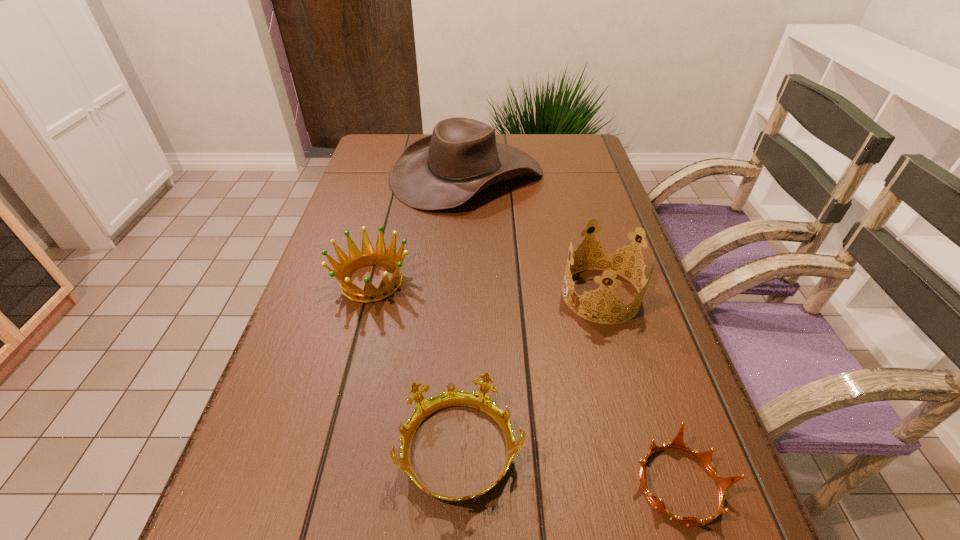
Where is `free space located 0.070m on the back of the shortest crown`? The width and height of the screenshot is (960, 540). free space located 0.070m on the back of the shortest crown is located at coordinates (x=653, y=401).

I want to click on object located in the far edge section of the desktop, so click(461, 157).

At what (x,y) coordinates should I click in order to perform the action: click on cowboy hat that is at the left edge. Please return your answer as a coordinate pair (x, y). Looking at the image, I should click on (461, 157).

At what (x,y) coordinates should I click in order to perform the action: click on crown that is at the left edge. Please return your answer as a coordinate pair (x, y). This screenshot has height=540, width=960. Looking at the image, I should click on (356, 260).

Where is `object that is at the far left corner`? This screenshot has width=960, height=540. object that is at the far left corner is located at coordinates (461, 157).

Identify the location of vacant space at the far edge of the desktop. The width and height of the screenshot is (960, 540). (504, 143).

In the image, there is a desktop. Where is `free space at the left edge`? Image resolution: width=960 pixels, height=540 pixels. free space at the left edge is located at coordinates (339, 407).

The image size is (960, 540). In the image, there is a desktop. What are the coordinates of `blank space at the right edge` in the screenshot? It's located at tap(595, 174).

The height and width of the screenshot is (540, 960). I want to click on vacant space at the far right corner of the desktop, so click(x=559, y=155).

Image resolution: width=960 pixels, height=540 pixels. I want to click on vacant space that is in between the leftmost crown and the shortest object, so click(526, 383).